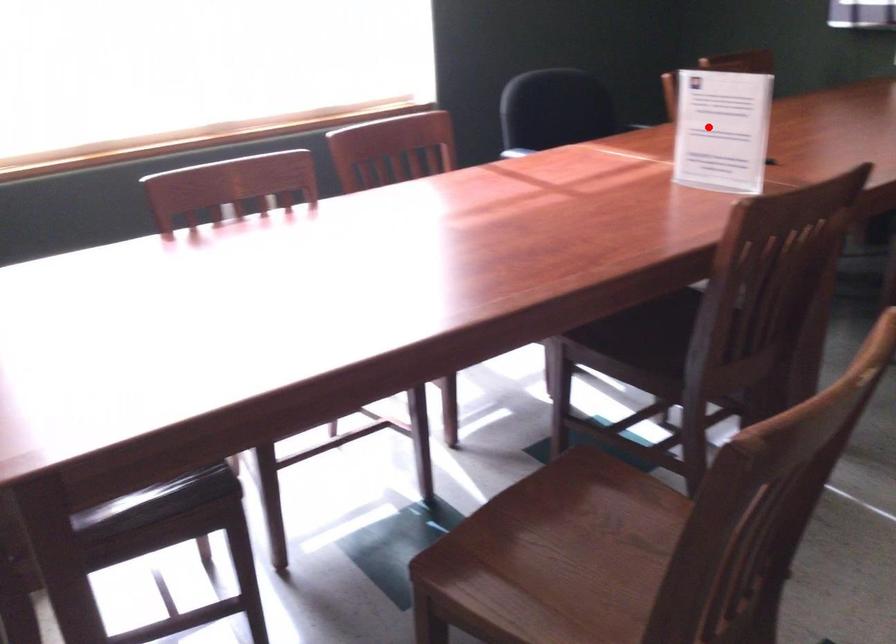
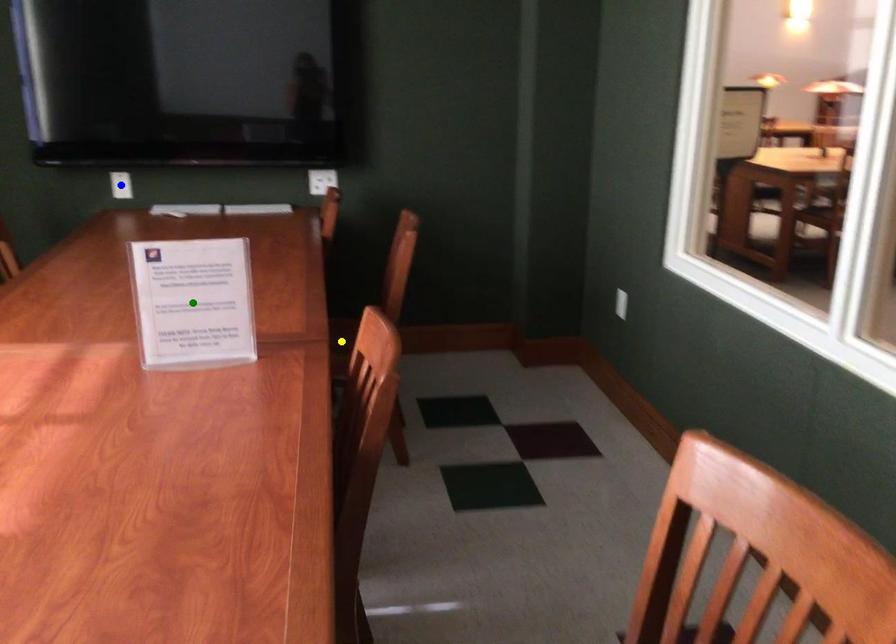
Question: I am providing you with two images of the same scene from different viewpoints. A red point is marked on the first image. You are given multiple points on the second image. Which mark in image 2 goes with the point in image 1?

Choices:
 (A) green point
 (B) yellow point
 (C) blue point

Answer: (A)